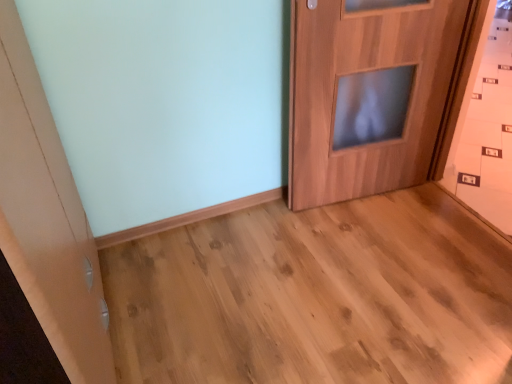
I want to click on vacant point to the right of wooden door at center, so click(x=421, y=213).